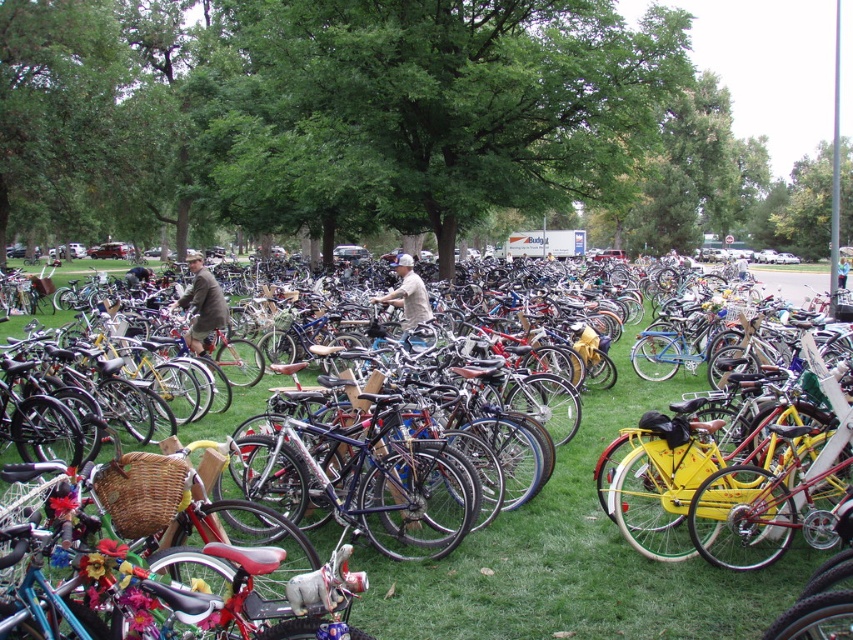
Can you confirm if green grass at center is thinner than beige cotton shirt at center?

In fact, green grass at center might be wider than beige cotton shirt at center.

Is green grass at center in front of beige cotton shirt at center?

That is True.

Find the location of `green grass at center`. green grass at center is located at coordinates (576, 557).

Which is behind, point (434, 561) or point (196, 296)?

The point (196, 296) is more distant.

Between point (607, 417) and point (195, 298), which one is positioned in front?

Point (607, 417) is more forward.

I want to click on green grass at center, so click(576, 557).

The height and width of the screenshot is (640, 853). I want to click on brown wool coat at center, so click(202, 304).

Is brown wool coat at center wider than beige cotton shirt at center?

Indeed, brown wool coat at center has a greater width compared to beige cotton shirt at center.

Who is more distant from viewer, (180, 300) or (393, 300)?

Positioned behind is point (393, 300).

Identify the location of brown wool coat at center. This screenshot has width=853, height=640. (202, 304).